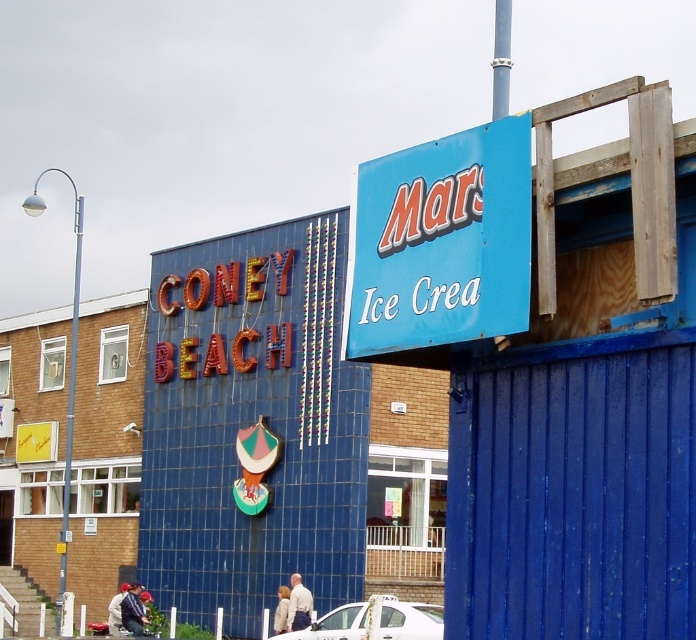
Between blue matte sign at upper right and white glossy car at lower center, which one appears on the right side from the viewer's perspective?

blue matte sign at upper right

From the picture: Can you confirm if blue matte sign at upper right is positioned above white glossy car at lower center?

Correct, blue matte sign at upper right is located above white glossy car at lower center.

This screenshot has height=640, width=696. Identify the location of blue matte sign at upper right. (441, 243).